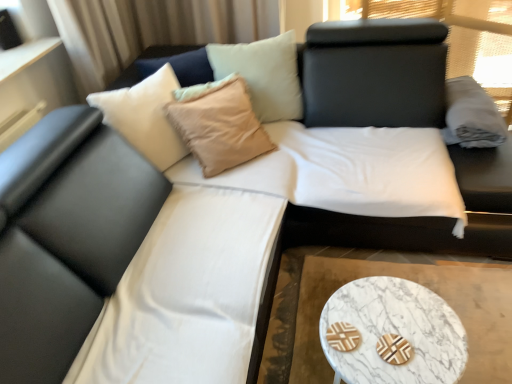
Where is `white fabric cushion at center`? white fabric cushion at center is located at coordinates (187, 293).

Measure the distance between gray cotton pillow at upper right and camera.

They are 6.62 feet apart.

What are the coordinates of `marble/stone coffee table at lower right` in the screenshot? It's located at (392, 334).

The width and height of the screenshot is (512, 384). What do you see at coordinates (392, 334) in the screenshot?
I see `marble/stone coffee table at lower right` at bounding box center [392, 334].

Image resolution: width=512 pixels, height=384 pixels. Describe the element at coordinates (344, 171) in the screenshot. I see `black leather bed at center` at that location.

This screenshot has width=512, height=384. Identify the location of beige fabric pillow at upper center. (220, 127).

Considering the relative sizes of white marble cocktail table at lower right and gray cotton pillow at upper right in the image provided, is white marble cocktail table at lower right wider than gray cotton pillow at upper right?

Yes, white marble cocktail table at lower right is wider than gray cotton pillow at upper right.

How different are the orientations of white marble cocktail table at lower right and gray cotton pillow at upper right in degrees?

90.7 degrees separate the facing orientations of white marble cocktail table at lower right and gray cotton pillow at upper right.

Consider the image. Is the surface of white marble cocktail table at lower right in direct contact with gray cotton pillow at upper right?

There is a gap between white marble cocktail table at lower right and gray cotton pillow at upper right.

Is white marble cocktail table at lower right not within gray cotton pillow at upper right?

Yes, white marble cocktail table at lower right is located beyond the bounds of gray cotton pillow at upper right.

Based on the photo, which is nearer, (183,111) or (496,126)?

The point (183,111) is closer to the camera.

Based on their sizes in the image, would you say beige fabric pillow at upper center is bigger or smaller than gray cotton pillow at upper right?

beige fabric pillow at upper center is bigger than gray cotton pillow at upper right.

How many degrees apart are the facing directions of beige fabric pillow at upper center and gray cotton pillow at upper right?

The angular difference between beige fabric pillow at upper center and gray cotton pillow at upper right is 41.2 degrees.

From the image's perspective, between beige fabric pillow at upper center and gray cotton pillow at upper right, which one is located above?

gray cotton pillow at upper right is shown above in the image.

Looking at this image, who is shorter, white marble cocktail table at lower right or beige fabric pillow at upper center?

With less height is white marble cocktail table at lower right.

Are white marble cocktail table at lower right and beige fabric pillow at upper center beside each other?

No, white marble cocktail table at lower right is not beside beige fabric pillow at upper center.

Is white marble cocktail table at lower right closer to camera compared to beige fabric pillow at upper center?

Yes, white marble cocktail table at lower right is closer to the viewer.

Consider the image. From a real-world perspective, which object rests below the other?

white marble cocktail table at lower right.

Is the surface of gray cotton pillow at upper right in direct contact with white fabric cushion at center?

No, gray cotton pillow at upper right is not with white fabric cushion at center.

Is point (462, 127) closer or farther from the camera than point (242, 364)?

Clearly, point (462, 127) is more distant from the camera than point (242, 364).

Could you tell me if gray cotton pillow at upper right is turned towards white fabric cushion at center?

No.

From the image's perspective, is gray cotton pillow at upper right above or below white fabric cushion at center?

gray cotton pillow at upper right is situated higher than white fabric cushion at center in the image.

From the image's perspective, does beige fabric pillow at upper center appear higher than white marble cocktail table at lower right?

Yes.

Measure the distance between beige fabric pillow at upper center and white marble cocktail table at lower right.

A distance of 30.60 inches exists between beige fabric pillow at upper center and white marble cocktail table at lower right.

In the image, is beige fabric pillow at upper center positioned in front of or behind white marble cocktail table at lower right?

beige fabric pillow at upper center is positioned farther from the viewer than white marble cocktail table at lower right.

Which is correct: beige fabric pillow at upper center is inside white marble cocktail table at lower right, or outside of it?

beige fabric pillow at upper center lies outside white marble cocktail table at lower right.

Would you say white fabric cushion at center is part of marble/stone coffee table at lower right's contents?

No, white fabric cushion at center is not a part of marble/stone coffee table at lower right.

Based on the photo, from a real-world perspective, which object rests below the other?

marble/stone coffee table at lower right.

Can you confirm if marble/stone coffee table at lower right is taller than white fabric cushion at center?

Incorrect, the height of marble/stone coffee table at lower right is not larger of that of white fabric cushion at center.

Is there a large distance between gray cotton pillow at upper right and marble/stone coffee table at lower right?

gray cotton pillow at upper right is far away from marble/stone coffee table at lower right.

Do you think gray cotton pillow at upper right is within marble/stone coffee table at lower right, or outside of it?

gray cotton pillow at upper right exists outside the volume of marble/stone coffee table at lower right.

Does gray cotton pillow at upper right have a smaller size compared to marble/stone coffee table at lower right?

Yes.

In the image, there is a gray cotton pillow at upper right. Where is `cocktail table below it (from the image's perspective)`? The height and width of the screenshot is (384, 512). cocktail table below it (from the image's perspective) is located at coordinates (388, 275).

At what (x,y) coordinates should I click in order to perform the action: click on pillow that is under the beige fabric pillow at upper center (from a real-world perspective). Please return your answer as a coordinate pair (x, y). This screenshot has width=512, height=384. Looking at the image, I should click on (472, 116).

Looking at the image, which one is located further to white fabric cushion at center, gray cotton pillow at upper right or beige fabric pillow at upper center?

The object further to white fabric cushion at center is gray cotton pillow at upper right.

Considering their positions, is marble/stone coffee table at lower right positioned closer to gray cotton pillow at upper right than beige fabric pillow at upper center?

beige fabric pillow at upper center is positioned closer to the anchor gray cotton pillow at upper right.

Estimate the real-world distances between objects in this image. Which object is closer to white marble cocktail table at lower right, gray cotton pillow at upper right or beige fabric pillow at upper center?

Among the two, beige fabric pillow at upper center is located nearer to white marble cocktail table at lower right.

Estimate the real-world distances between objects in this image. Which object is further from gray cotton pillow at upper right, white marble cocktail table at lower right or white fabric cushion at center?

white fabric cushion at center.

Based on their spatial positions, is white marble cocktail table at lower right or black leather bed at center closer to beige fabric pillow at upper center?

black leather bed at center.

When comparing their distances from white fabric cushion at center, does white marble cocktail table at lower right or gray cotton pillow at upper right seem closer?

white marble cocktail table at lower right is positioned closer to the anchor white fabric cushion at center.

Considering their positions, is black leather bed at center positioned closer to gray cotton pillow at upper right than beige fabric pillow at upper center?

Based on the image, black leather bed at center appears to be nearer to gray cotton pillow at upper right.

From the image, which object appears to be farther from beige fabric pillow at upper center, white fabric cushion at center or black leather bed at center?

Based on the image, white fabric cushion at center appears to be further to beige fabric pillow at upper center.

Locate an element on the screen. This screenshot has height=384, width=512. cocktail table between beige fabric pillow at upper center and marble/stone coffee table at lower right in the vertical direction is located at coordinates (388, 275).

Locate an element on the screen. This screenshot has width=512, height=384. bed between beige fabric pillow at upper center and white marble cocktail table at lower right from top to bottom is located at coordinates (344, 171).

The image size is (512, 384). Identify the location of coffee table located between beige fabric pillow at upper center and gray cotton pillow at upper right in the left-right direction. (392, 334).

In order to click on coffee table between white fabric cushion at center and gray cotton pillow at upper right in the horizontal direction in this screenshot , I will do (392, 334).